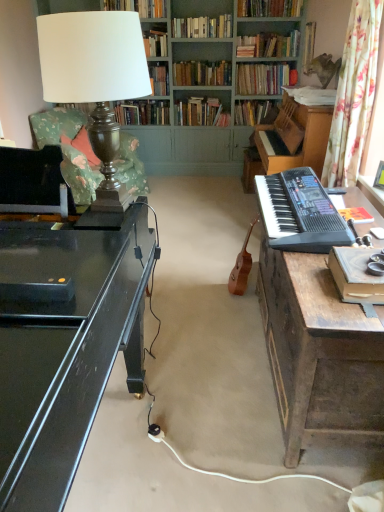
Locate an element on the screen. Image resolution: width=384 pixels, height=512 pixels. vacant space situated on the left part of wooden book at right, which is the twelfth book from back to front is located at coordinates (312, 290).